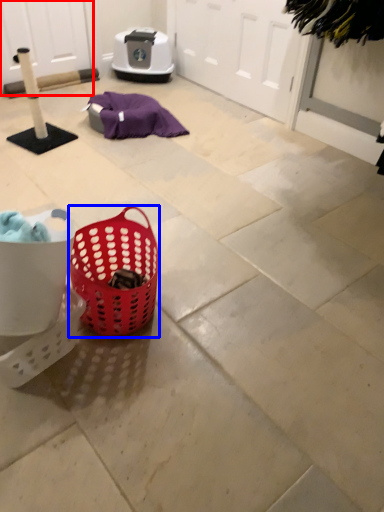
Question: Which point is further to the camera, screen door (highlighted by a red box) or picnic basket (highlighted by a blue box)?

Choices:
 (A) screen door
 (B) picnic basket

Answer: (A)